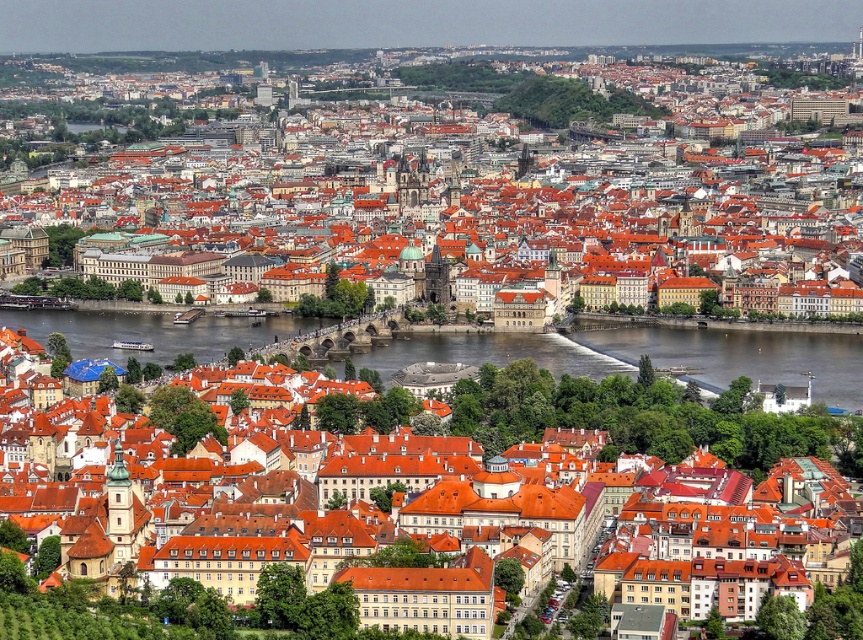
Question: Which object is farther from the camera taking this photo?

Choices:
 (A) matte orange rooftops at center
 (B) orange tiled roofs at center

Answer: (B)

Question: Based on their relative distances, which object is farther from the orange tiled roofs at center?

Choices:
 (A) matte orange rooftops at center
 (B) brown water at center

Answer: (A)

Question: Is orange tiled roofs at center further to camera compared to matte orange rooftops at center?

Choices:
 (A) yes
 (B) no

Answer: (A)

Question: Considering the relative positions of orange tiled roofs at center and brown water at center in the image provided, where is orange tiled roofs at center located with respect to brown water at center?

Choices:
 (A) above
 (B) below

Answer: (A)

Question: Which of the following is the farthest from the observer?

Choices:
 (A) (763, 340)
 (B) (741, 461)
 (C) (559, 220)

Answer: (C)

Question: Is orange tiled roofs at center wider than brown water at center?

Choices:
 (A) yes
 (B) no

Answer: (A)